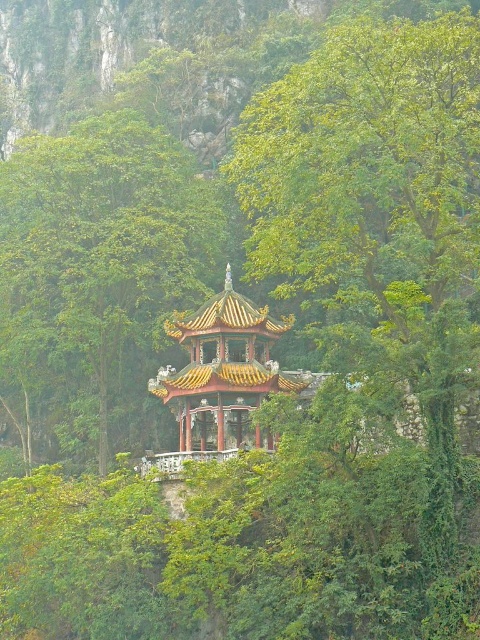
Looking at this image, you are standing at the base of the pavilion and want to take a photo of the point marked as point (97,282). Is this point located in the center of the image?

The green leafy tree at center is represented by point (97,282), so yes, the point is in the center of the image.

You are standing in a forest and see the green leafy tree at center. If you want to reach the tree within 10 minutes, what is the minimum speed you need to walk at?

The green leafy tree at center is 79.35 meters away. To reach it within 10 minutes, you need to walk at a minimum speed of 0.7935 meters per second.